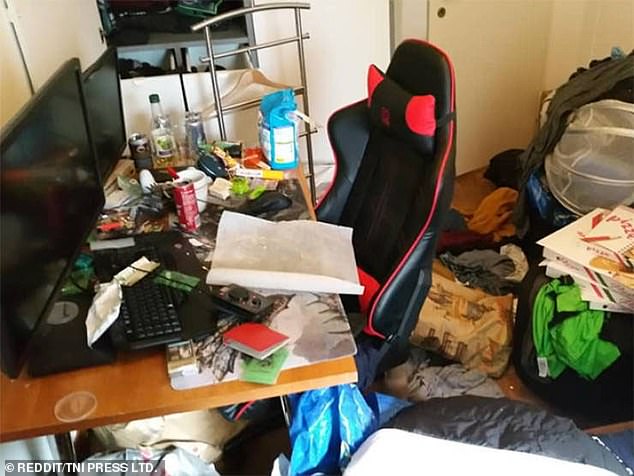
In order to click on floor in this screenshot , I will do `click(477, 190)`.